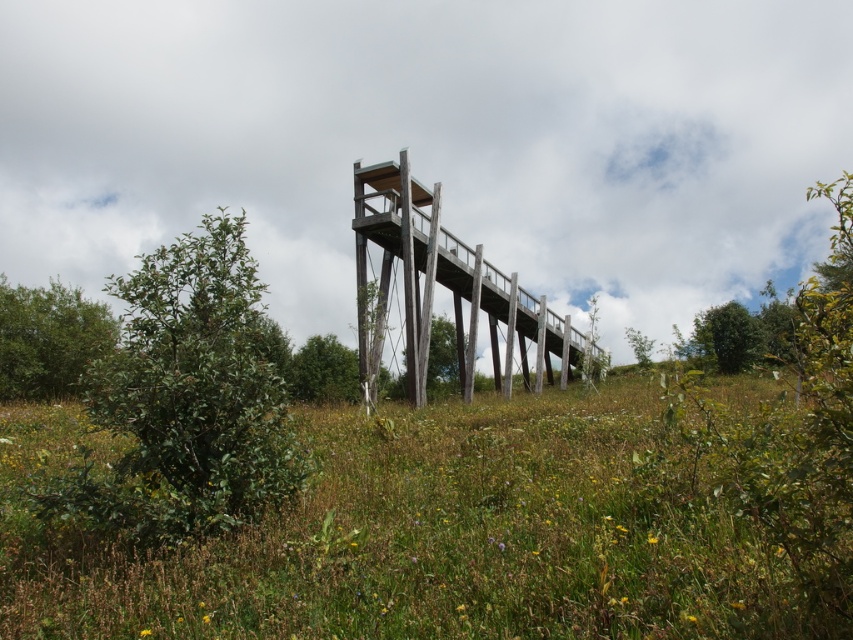
You are standing at the base of the wooden observation tower and notice two green leafy trees in the scene. Which tree, the green leafy tree at left or the green leafy tree at right, is taller?

The green leafy tree at right is taller than the green leafy tree at left.

You are standing at the base of the wooden observation tower and looking towards the top platform. There are two points marked on the tower structure. Which point is closer to you, point (144, 326) or point (16, 342)?

Point (144, 326) is closer to you than point (16, 342).

You are planning to install a new pathway between the green leafy tree at left and the green matte tree at center. The pathway requires a minimum of 100 feet of space. Based on the scene, can the pathway be constructed between these two trees?

The distance between the green leafy tree at left and the green matte tree at center is 85.89 feet, which is less than the required 100 feet. Therefore, the pathway cannot be constructed between these two trees.